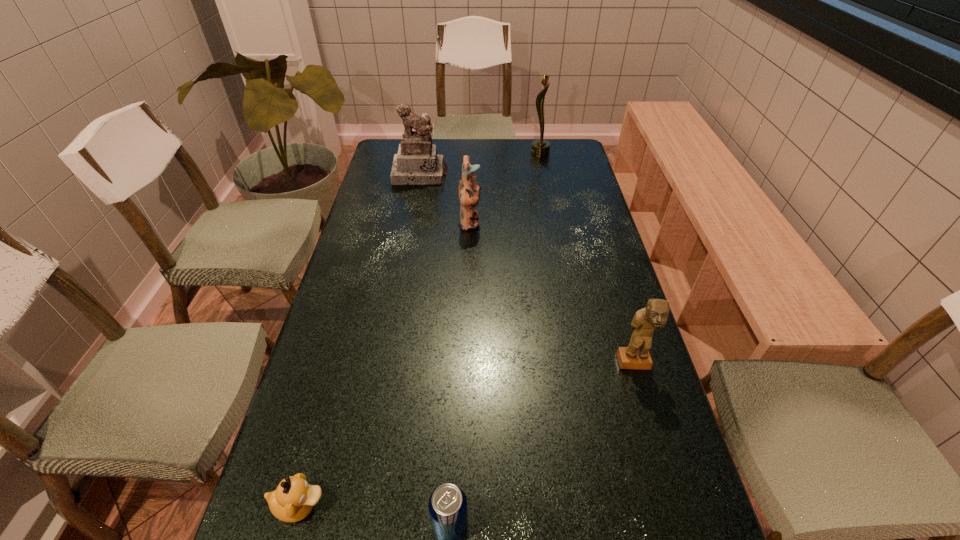
Where is `the fifth object from left to right`? the fifth object from left to right is located at coordinates (540, 148).

Where is `award`? award is located at coordinates (540, 148).

At what (x,y) coordinates should I click in order to perform the action: click on the leftmost figurine. Please return your answer as a coordinate pair (x, y). This screenshot has width=960, height=540. Looking at the image, I should click on (417, 163).

This screenshot has height=540, width=960. Find the location of `the tallest figurine`. the tallest figurine is located at coordinates (417, 163).

Find the location of a particular element. the second figurine from left to right is located at coordinates [x=469, y=190].

This screenshot has width=960, height=540. Identify the location of the second farthest figurine. (469, 190).

The height and width of the screenshot is (540, 960). I want to click on the rightmost figurine, so click(636, 356).

Where is `the rightmost object`? the rightmost object is located at coordinates (636, 356).

This screenshot has height=540, width=960. I want to click on the shortest object, so click(x=293, y=500).

This screenshot has height=540, width=960. Identify the location of vacant point located 0.060m on the front-facing side of the fifth object from left to right. (516, 154).